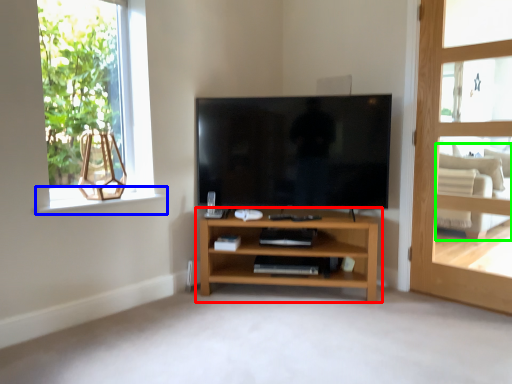
Question: Which is nearer to the shelf (highlighted by a red box)? window sill (highlighted by a blue box) or armchair (highlighted by a green box).

Choices:
 (A) window sill
 (B) armchair

Answer: (A)